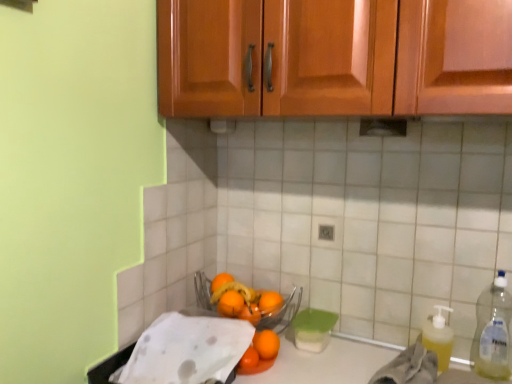
What are the coordinates of `orange matte at center, the 4th orange in the back-to-front sequence` in the screenshot? It's located at (230, 304).

Image resolution: width=512 pixels, height=384 pixels. In order to click on orange matte at center, the 4th orange in the front-to-back sequence in this screenshot , I will do `click(250, 313)`.

Find the location of a particular element. This screenshot has width=512, height=384. yellow translucent liquid at lower right, positioned as the first material in right-to-left order is located at coordinates (409, 367).

What do you see at coordinates (220, 281) in the screenshot?
I see `orange matte at center, acting as the fifth orange starting from the front` at bounding box center [220, 281].

Measure the distance between point (256, 336) and camera.

1.22 meters.

Measure the distance between orange matte at center, the 5th orange from the back, and camera.

A distance of 1.16 meters exists between orange matte at center, the 5th orange from the back, and camera.

Measure the distance between point (489, 346) and camera.

The distance of point (489, 346) from camera is 1.13 meters.

Identify the location of white paper towel at lower left, which is the first material from left to right. (186, 350).

Is white paper towel at lower left, which is the second material in right-to-left order, behind orange matte at center, the first orange positioned from the back?

No, white paper towel at lower left, which is the second material in right-to-left order, is closer to the camera.

Does white paper towel at lower left, which is the second material in right-to-left order, appear on the left side of orange matte at center, the first orange positioned from the back?

Correct, you'll find white paper towel at lower left, which is the second material in right-to-left order, to the left of orange matte at center, the first orange positioned from the back.

Does white paper towel at lower left, which is the first material from left to right, touch orange matte at center, the first orange positioned from the back?

They are not placed beside each other.

Which material is the 2nd one when counting from the front of the orange matte at center, acting as the fifth orange starting from the front? Please provide its 2D coordinates.

[(186, 350)]

Considering the positions of point (440, 328) and point (270, 355), is point (440, 328) closer or farther from the camera than point (270, 355)?

Clearly, point (440, 328) is closer to the camera than point (270, 355).

Is yellow translucent liquid at right surrounding orange matte at center, the 5th orange from the back?

No, orange matte at center, the 5th orange from the back, is located outside of yellow translucent liquid at right.

Are yellow translucent liquid at right and orange matte at center, which is the 1th orange in front-to-back order, far apart?

No, yellow translucent liquid at right is in close proximity to orange matte at center, which is the 1th orange in front-to-back order.

Looking at their sizes, would you say orange matte at center, the 5th orange from the back, is wider or thinner than orange matte at center, the 4th orange in the front-to-back sequence?

Clearly, orange matte at center, the 5th orange from the back, has more width compared to orange matte at center, the 4th orange in the front-to-back sequence.

Considering the positions of objects orange matte at center, which is the 1th orange in front-to-back order, and orange matte at center, the 4th orange in the front-to-back sequence, in the image provided, who is in front, orange matte at center, which is the 1th orange in front-to-back order, or orange matte at center, the 4th orange in the front-to-back sequence,?

orange matte at center, which is the 1th orange in front-to-back order, is more forward.

Considering the relative sizes of orange matte at center, the 5th orange from the back, and orange matte at center, the 4th orange in the front-to-back sequence, in the image provided, is orange matte at center, the 5th orange from the back, bigger than orange matte at center, the 4th orange in the front-to-back sequence,?

Yes.

Could you tell me if orange matte at center, the 5th orange from the back, is turned towards orange matte at center, the 4th orange in the front-to-back sequence?

No, orange matte at center, the 5th orange from the back, does not turn towards orange matte at center, the 4th orange in the front-to-back sequence.

Does orange matte at center, acting as the fifth orange starting from the front, turn towards white paper towel at lower left, which is the second material in right-to-left order?

Yes, orange matte at center, acting as the fifth orange starting from the front, is oriented towards white paper towel at lower left, which is the second material in right-to-left order.

Which of these two, orange matte at center, the first orange positioned from the back, or white paper towel at lower left, which is the second material in right-to-left order, stands taller?

Standing taller between the two is white paper towel at lower left, which is the second material in right-to-left order.

In the scene shown: Can you tell me how much orange matte at center, acting as the fifth orange starting from the front, and white paper towel at lower left, which is the first material from left to right, differ in facing direction?

The angle between the facing direction of orange matte at center, acting as the fifth orange starting from the front, and the facing direction of white paper towel at lower left, which is the first material from left to right, is 2.2 degrees.

In the scene shown: Is orange matte at center, the first orange positioned from the back, outside of white paper towel at lower left, which is the first material from left to right?

Yes.

Is orange matte at center, the 4th orange in the front-to-back sequence, turned away from orange matte at center, the 4th orange in the back-to-front sequence?

No, orange matte at center, the 4th orange in the back-to-front sequence, is not at the back of orange matte at center, the 4th orange in the front-to-back sequence.

Which object is positioned more to the right, orange matte at center, the 4th orange in the front-to-back sequence, or orange matte at center, the 4th orange in the back-to-front sequence?

Positioned to the right is orange matte at center, the 4th orange in the front-to-back sequence.

Does point (256, 324) come farther from viewer compared to point (227, 292)?

No, it is not.

Where is `the 2nd orange positioned below the orange matte at center, which is the second orange from front to back (from a real-world perspective)`? This screenshot has width=512, height=384. the 2nd orange positioned below the orange matte at center, which is the second orange from front to back (from a real-world perspective) is located at coordinates (250, 313).

From the image's perspective, is orange matte at center, acting as the 2th orange starting from the back, on top of clear plastic bottle at right?

No, from the image's perspective, orange matte at center, acting as the 2th orange starting from the back, is not over clear plastic bottle at right.

Which object is wider, orange matte at center, the 4th orange in the front-to-back sequence, or clear plastic bottle at right?

With larger width is clear plastic bottle at right.

Which is in front, orange matte at center, acting as the 2th orange starting from the back, or clear plastic bottle at right?

clear plastic bottle at right is more forward.

Between yellow translucent liquid at right and clear plastic bottle at right, which one has larger size?

With larger size is clear plastic bottle at right.

Is yellow translucent liquid at right inside the boundaries of clear plastic bottle at right, or outside?

yellow translucent liquid at right is not enclosed by clear plastic bottle at right.

Does point (431, 316) appear closer or farther from the camera than point (479, 345)?

Point (431, 316) appears to be farther away from the viewer than point (479, 345).

The image size is (512, 384). I want to click on cleaning product behind the clear plastic bottle at right, so click(438, 337).

Where is `material that is the 2nd object located in front of the orange matte at center, the first orange positioned from the back`? material that is the 2nd object located in front of the orange matte at center, the first orange positioned from the back is located at coordinates (186, 350).

The width and height of the screenshot is (512, 384). Find the location of `the 2nd orange located beneath the yellow translucent liquid at right (from a real-world perspective)`. the 2nd orange located beneath the yellow translucent liquid at right (from a real-world perspective) is located at coordinates (266, 344).

From the image, which object appears to be farther from orange matte at center, acting as the 2th orange starting from the back, yellow translucent liquid at lower right, positioned as the 2th material in left-to-right order, or orange matte at center, which is the 1th orange in front-to-back order?

yellow translucent liquid at lower right, positioned as the 2th material in left-to-right order, lies further to orange matte at center, acting as the 2th orange starting from the back, than the other object.

Estimate the real-world distances between objects in this image. Which object is closer to clear plastic bottle at right, yellow translucent liquid at right or orange matte at center, the first orange positioned from the back?

The object closer to clear plastic bottle at right is yellow translucent liquid at right.

In the scene shown: Which object lies nearer to the anchor point orange matte at center, the 5th orange from the back, orange matte at center, the first orange positioned from the back, or orange matte at center, the 4th orange in the front-to-back sequence?

Based on the image, orange matte at center, the 4th orange in the front-to-back sequence, appears to be nearer to orange matte at center, the 5th orange from the back.

When comparing their distances from orange matte at center, the first orange positioned from the back, does orange matte at center, the 5th orange from the back, or orange matte at center, the 3th orange positioned from the front, seem further?

orange matte at center, the 5th orange from the back, is positioned further to the anchor orange matte at center, the first orange positioned from the back.

Considering their positions, is orange matte at center, the first orange positioned from the back, positioned further to yellow translucent liquid at lower right, positioned as the first material in right-to-left order, than orange matte at center, the 4th orange in the back-to-front sequence?

Based on the image, orange matte at center, the first orange positioned from the back, appears to be further to yellow translucent liquid at lower right, positioned as the first material in right-to-left order.

Based on their spatial positions, is orange matte at center, the 3th orange positioned from the front, or white paper towel at lower left, which is the first material from left to right, further from yellow translucent liquid at right?

white paper towel at lower left, which is the first material from left to right, lies further to yellow translucent liquid at right than the other object.

When comparing their distances from orange matte at center, the 5th orange from the back, does orange matte at center, acting as the fifth orange starting from the front, or orange matte at center, arranged as the 3th orange when viewed from the back, seem closer?

orange matte at center, arranged as the 3th orange when viewed from the back.

Looking at this image, when comparing their distances from orange matte at center, the first orange positioned from the back, does orange matte at center, arranged as the 3th orange when viewed from the back, or yellow translucent liquid at right seem further?

Based on the image, yellow translucent liquid at right appears to be further to orange matte at center, the first orange positioned from the back.

You are a GUI agent. You are given a task and a screenshot of the screen. Output one action in this format:
    pyautogui.click(x=<x>, y=<y>)
    Task: Click on the orange that lies between orange matte at center, arranged as the 3th orange when viewed from the back, and orange matte at center, which is the 1th orange in front-to-back order, from top to bottom
    Image resolution: width=512 pixels, height=384 pixels.
    Given the screenshot: What is the action you would take?
    pyautogui.click(x=250, y=313)

You are a GUI agent. You are given a task and a screenshot of the screen. Output one action in this format:
    pyautogui.click(x=<x>, y=<y>)
    Task: Click on the orange between orange matte at center, the 4th orange in the back-to-front sequence, and orange matte at center, the 5th orange from the back
    This screenshot has height=384, width=512.
    Given the screenshot: What is the action you would take?
    pyautogui.click(x=250, y=313)

At what (x,y) coordinates should I click in order to perform the action: click on material between orange matte at center, acting as the 2th orange starting from the back, and yellow translucent liquid at right. Please return your answer as a coordinate pair (x, y). The height and width of the screenshot is (384, 512). Looking at the image, I should click on (409, 367).

Find the location of a particular element. The image size is (512, 384). orange situated between orange matte at center, which is the 1th orange in front-to-back order, and yellow translucent liquid at lower right, positioned as the first material in right-to-left order, from left to right is located at coordinates (270, 302).